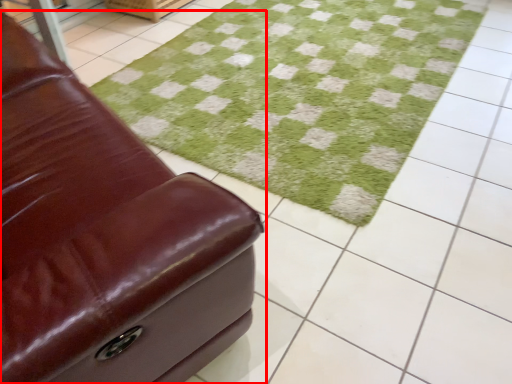
Question: Considering the relative positions of furniture (annotated by the red box) and grass in the image provided, where is furniture (annotated by the red box) located with respect to the staircase?

Choices:
 (A) right
 (B) left

Answer: (B)